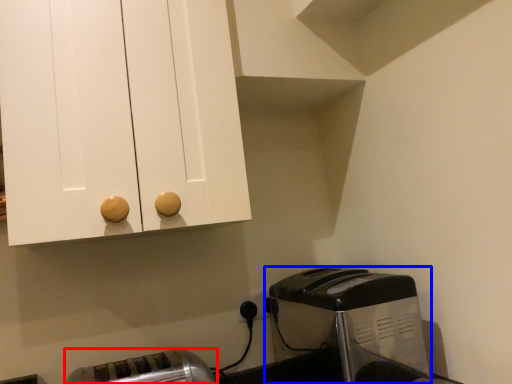
Question: Which point is closer to the camera, toaster (highlighted by a red box) or toaster (highlighted by a blue box)?

Choices:
 (A) toaster
 (B) toaster

Answer: (A)